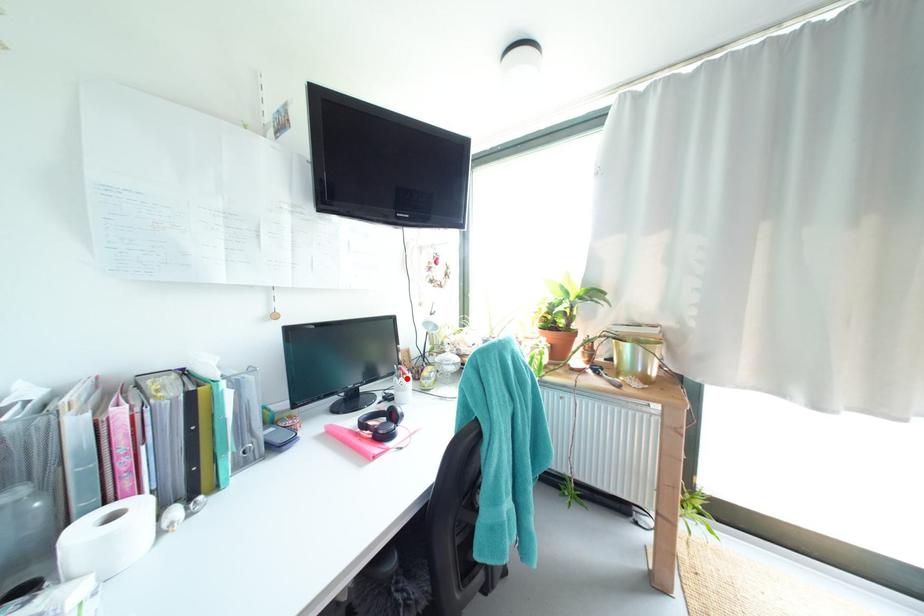
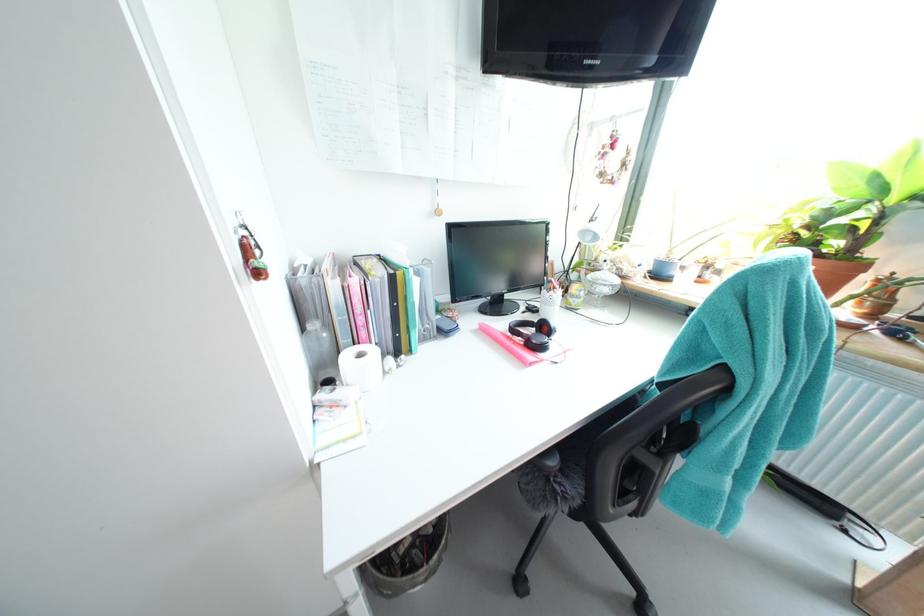
Locate, in the second image, the point that corresponds to the highlighted location in the first image.

(556, 292)